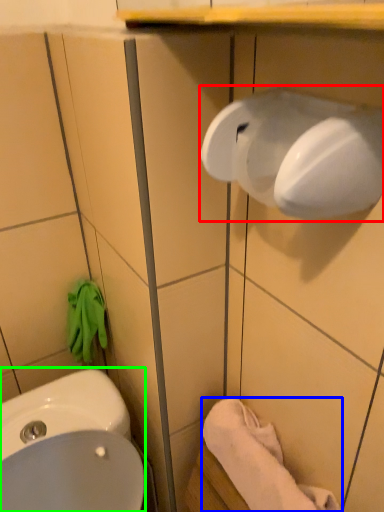
Question: Considering the real-world distances, which object is closest to hand dryer (highlighted by a red box)? towel/napkin (highlighted by a blue box) or sink (highlighted by a green box).

Choices:
 (A) towel/napkin
 (B) sink

Answer: (A)